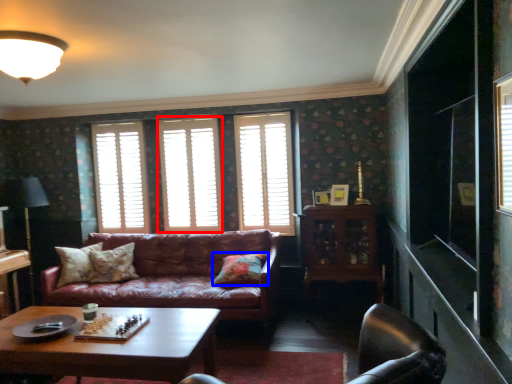
Question: Which of the following is the closest to the observer, window (highlighted by a red box) or pillow (highlighted by a blue box)?

Choices:
 (A) window
 (B) pillow

Answer: (B)